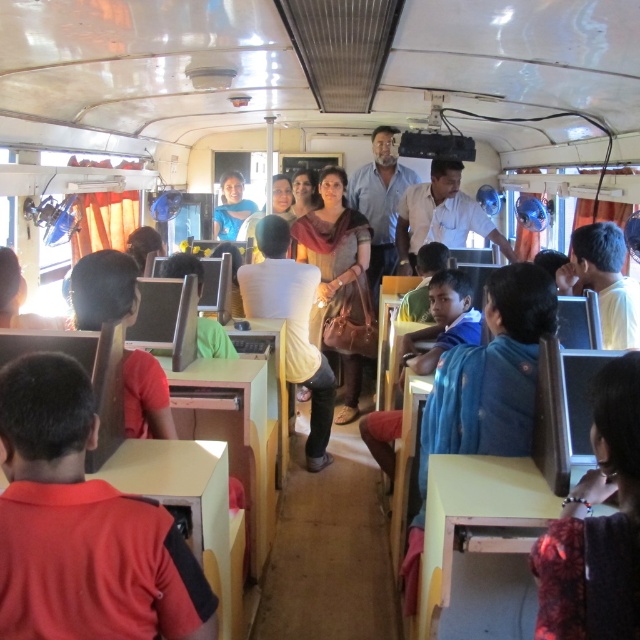
The image size is (640, 640). Describe the element at coordinates (83, 525) in the screenshot. I see `red matte shirt at lower left` at that location.

Between point (54, 406) and point (596, 397), which one is positioned in front?

Point (54, 406) is more forward.

At what (x,y) coordinates should I click in order to perform the action: click on red matte shirt at lower left. Please return your answer as a coordinate pair (x, y). This screenshot has width=640, height=640. Looking at the image, I should click on (83, 525).

Find the location of a particular element. The width and height of the screenshot is (640, 640). red matte shirt at lower left is located at coordinates (83, 525).

Is point (541, 540) positioned behind point (356, 205)?

No.

Find the location of a particular element. dark red fabric at center is located at coordinates (596, 525).

Which is behind, point (608, 387) or point (364, 172)?

Positioned behind is point (364, 172).

Find the location of a particular element. dark red fabric at center is located at coordinates (596, 525).

Is red matte shirt at lower left shorter than blue fabric coach at center?

Yes.

Is point (17, 522) positioned behind point (387, 224)?

No, it is not.

The height and width of the screenshot is (640, 640). What are the coordinates of `red matte shirt at lower left` in the screenshot? It's located at (83, 525).